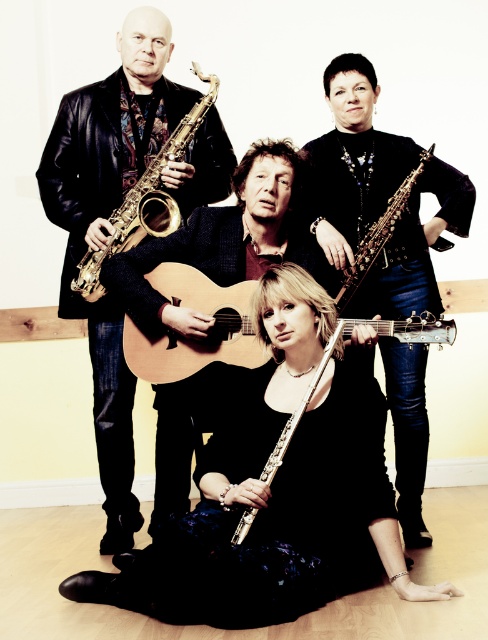
Question: Can you confirm if gold metallic saxophone at left is positioned above shiny silver flute at lower center?

Choices:
 (A) yes
 (B) no

Answer: (A)

Question: Which object appears farthest from the camera in this image?

Choices:
 (A) shiny silver flute at center
 (B) gold metallic saxophone at left
 (C) shiny silver flute at lower center

Answer: (B)

Question: Which point is farther to the camera?

Choices:
 (A) gold metallic saxophone at left
 (B) shiny silver flute at lower center

Answer: (A)

Question: Which of these objects is positioned closest to the shiny silver flute at center?

Choices:
 (A) acoustic wood guitar at center
 (B) gold metallic saxophone at left
 (C) shiny black leather jacket at left

Answer: (A)

Question: Is shiny silver flute at center positioned before gold metallic saxophone at left?

Choices:
 (A) yes
 (B) no

Answer: (A)

Question: Does shiny black saxophone at upper right appear under shiny silver flute at lower center?

Choices:
 (A) no
 (B) yes

Answer: (A)